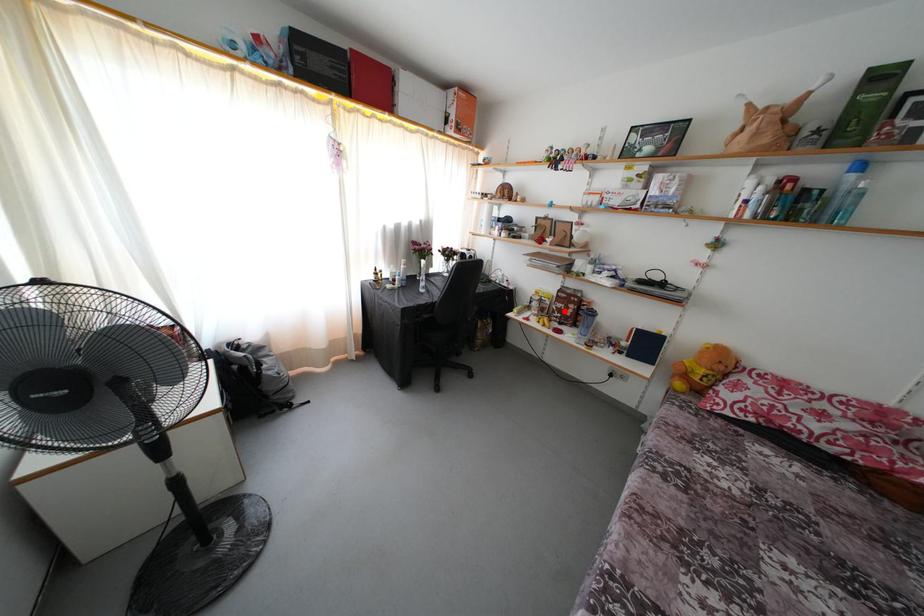
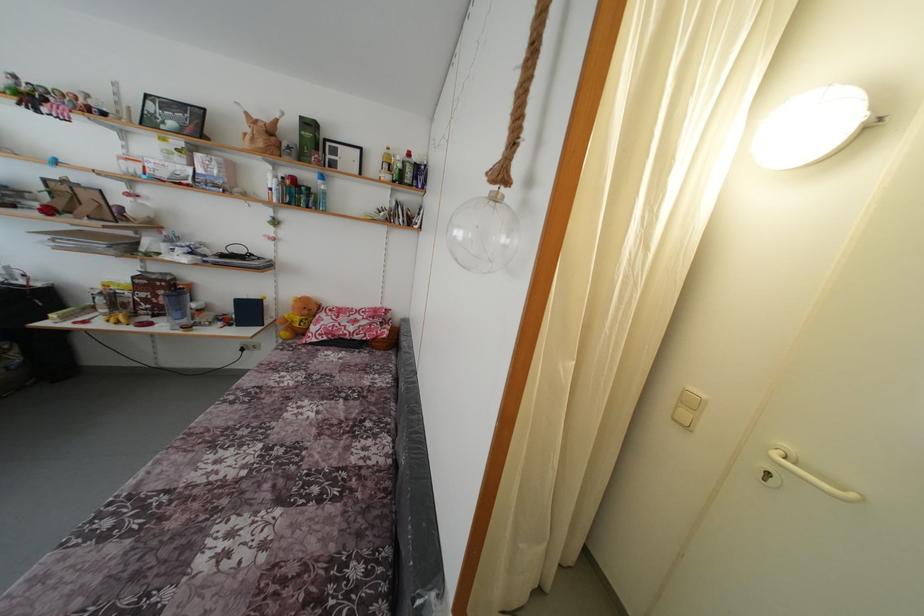
Where in the second image is the point corresponding to the highlighted location from the first image?

(149, 301)